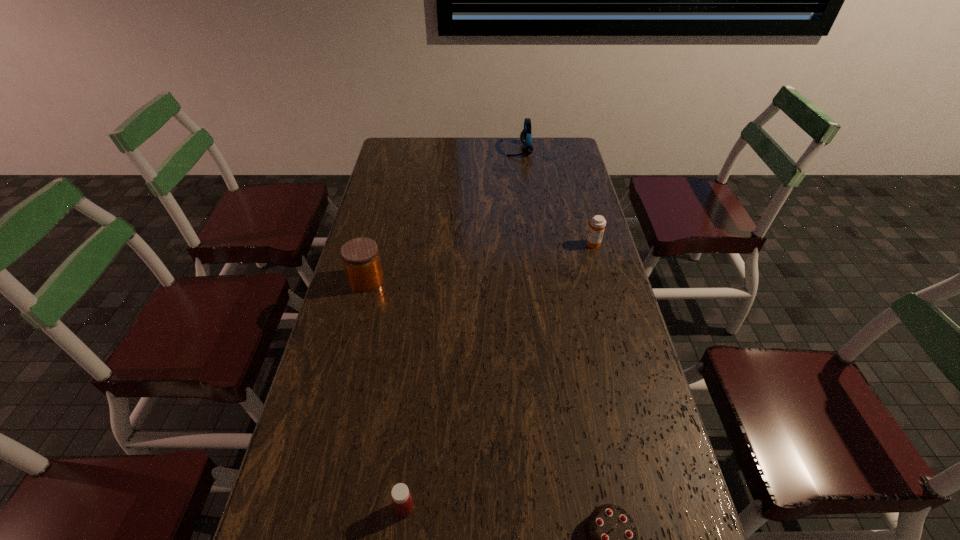
The image size is (960, 540). What are the coordinates of `free location that satisfies the following two spatial constraints: 1. with the microphone attached to the side of the headset; 2. on the left side of the third shortest object` in the screenshot? It's located at (531, 244).